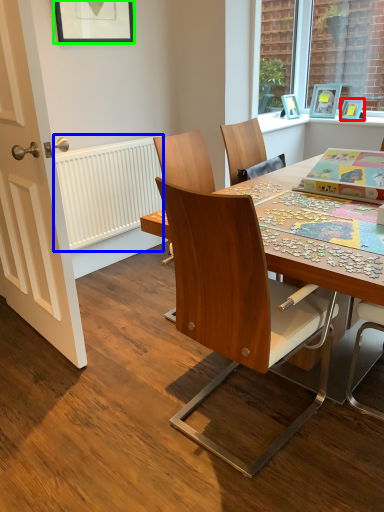
Question: Based on their relative distances, which object is farther from picture frame (highlighted by a red box)? Choose from radiator (highlighted by a blue box) and picture frame (highlighted by a green box).

Choices:
 (A) radiator
 (B) picture frame

Answer: (B)